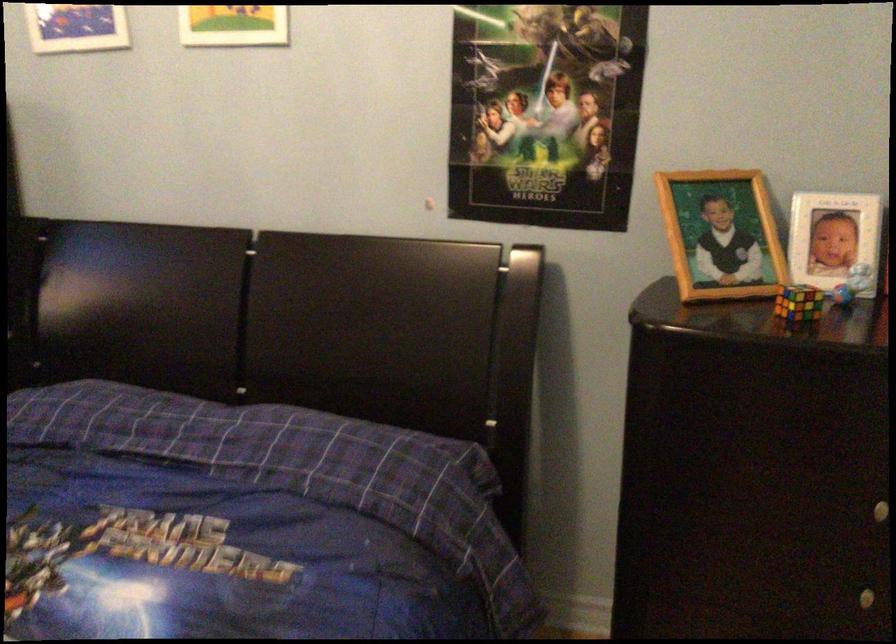
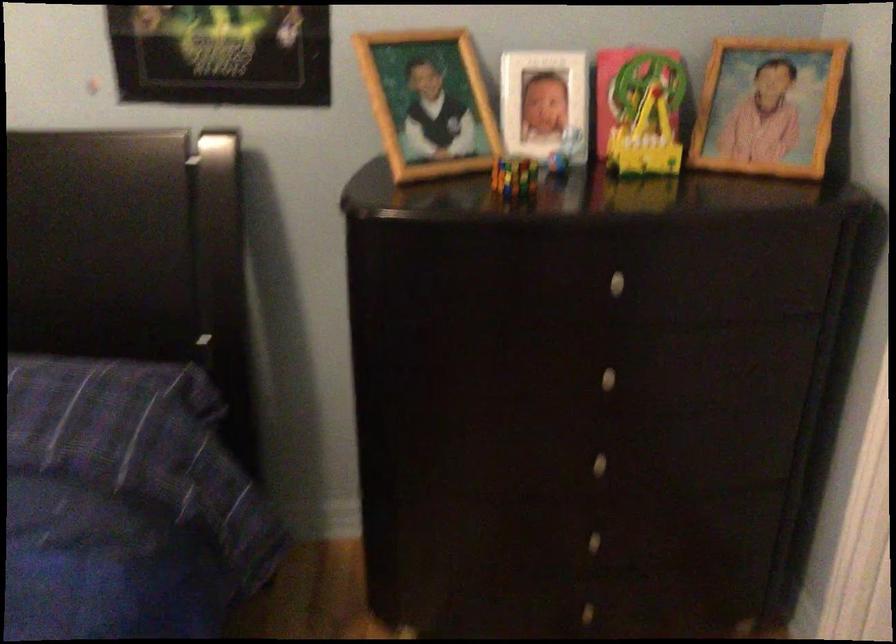
The images are taken continuously from a first-person perspective. In which direction are you moving?

The cameraman walked toward right, forward.